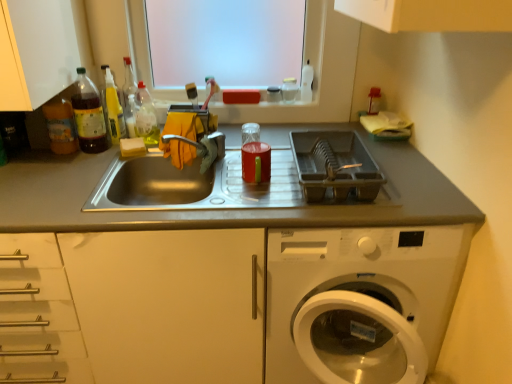
Question: Looking at their shapes, would you say translucent plastic bottle at upper left, which appears as the fourth bottle when viewed from the left, is wider or thinner than plastic dish rack at right?

Choices:
 (A) wide
 (B) thin

Answer: (B)

Question: Relative to plastic dish rack at right, is translucent plastic bottle at upper left, which ranks as the 1th bottle in right-to-left order, in front or behind?

Choices:
 (A) behind
 (B) front

Answer: (A)

Question: Based on their relative distances, which object is nearer to the translucent plastic bottle at left, marked as the second bottle in a left-to-right arrangement?

Choices:
 (A) translucent plastic bottle at left, the 4th bottle viewed from the right
 (B) metallic sink at center, the 2th countertop when ordered from right to left
 (C) plastic dish rack at right
 (D) translucent plastic bottle at left, the third bottle from the left
 (E) white sponge at sink left

Answer: (A)

Question: Estimate the real-world distances between objects in this image. Which object is closer to the translucent plastic bottle at left, the third bottle from the left?

Choices:
 (A) plastic dish rack at right
 (B) translucent plastic bottle at upper left, which ranks as the 1th bottle in right-to-left order
 (C) transparent plastic window screen at upper center
 (D) metallic sink at center, positioned as the 1th countertop in left-to-right order
 (E) translucent plastic bottle at left, marked as the second bottle in a left-to-right arrangement

Answer: (E)